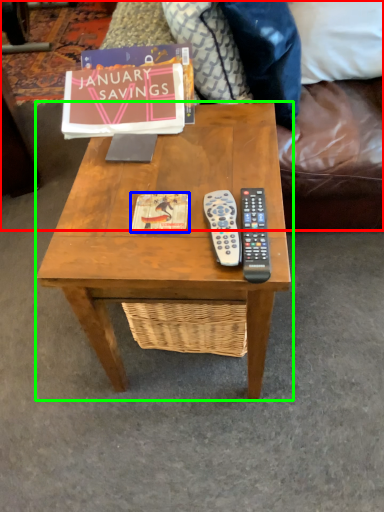
Question: Which is nearer to the studio couch (highlighted by a red box)? book cover (highlighted by a blue box) or coffee table (highlighted by a green box).

Choices:
 (A) book cover
 (B) coffee table

Answer: (B)